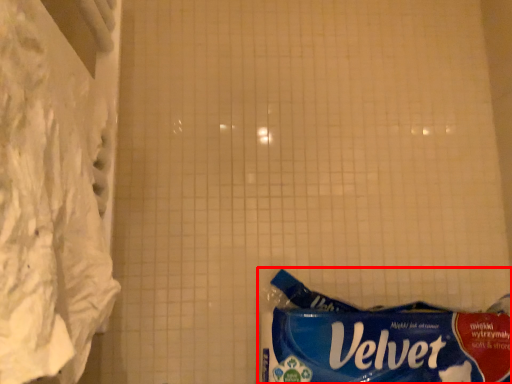
Question: Considering the relative positions of waste (annotated by the red box) and curtain in the image provided, where is waste (annotated by the red box) located with respect to the staircase?

Choices:
 (A) left
 (B) right

Answer: (B)